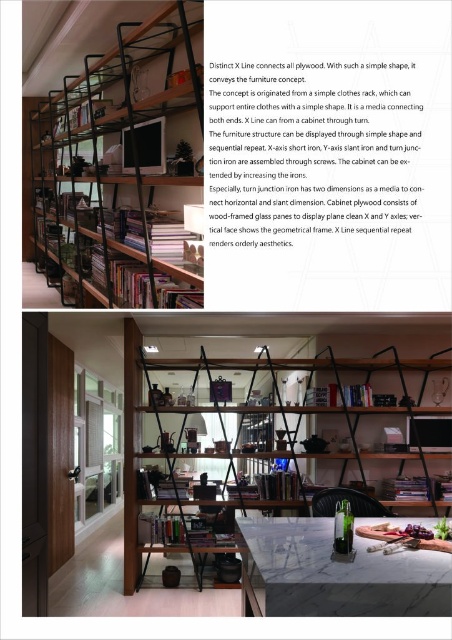
You are organizing books in the home office and need to place a tall book that requires a shelf at least 30 cm in height. Based on the image, which shelf should you choose between the black matte bookshelf at upper left and the matte black shelving unit at center?

The matte black shelving unit at center is taller than the black matte bookshelf at upper left, so you should choose the matte black shelving unit at center to accommodate the tall book.

You are standing in front of the modern shelving unit in the top section of the image. You notice two points marked on the shelves. The first point is at coordinates point (109, 244) and the second is at point (428, 470). Which of these points is nearer to you?

Point (109, 244) is closer to the viewer than point (428, 470).